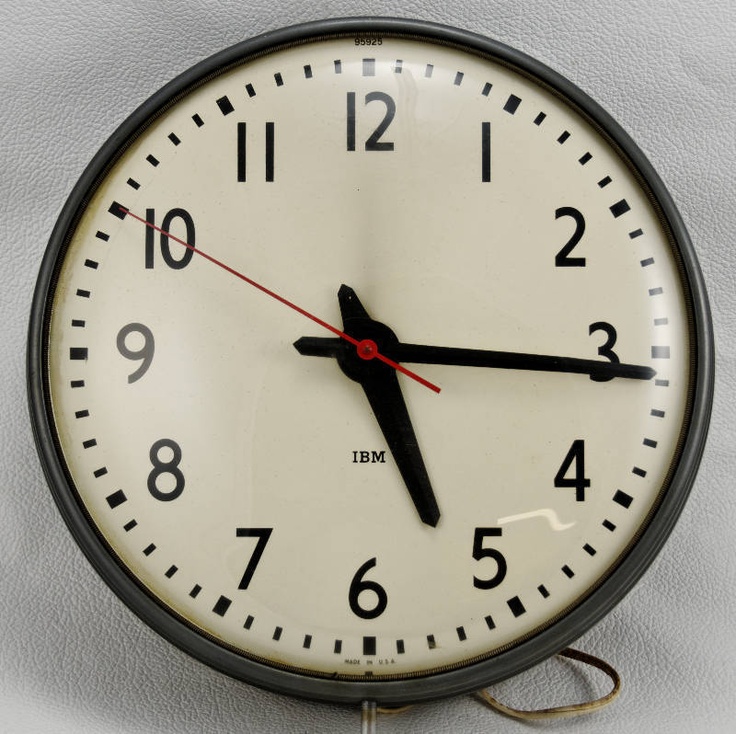
Image resolution: width=736 pixels, height=734 pixels. Identify the location of textured wall. (169, 694).